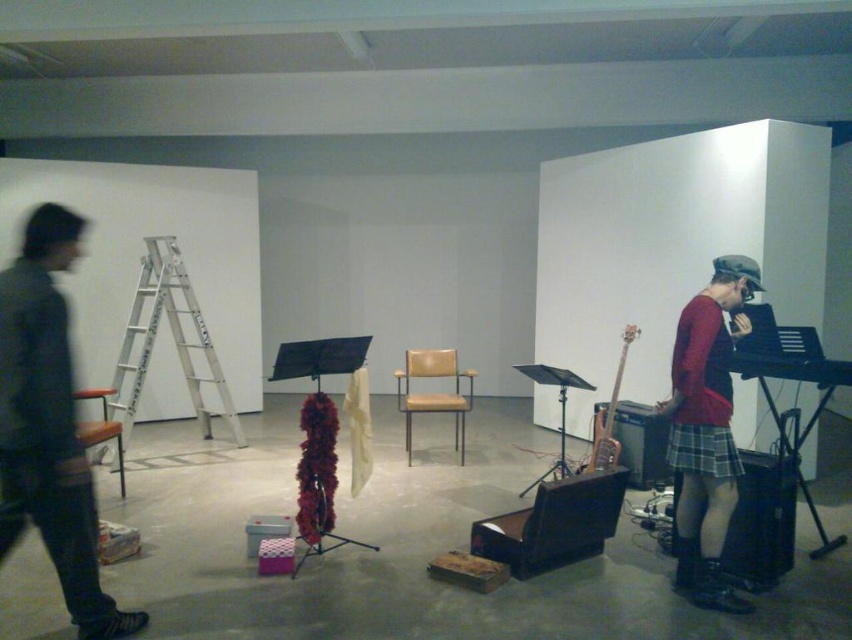
You are an interior designer observing the studio. You need to move the tan leather chair at center to a different location. However, you must ensure that the red matte sweater at right remains visible from the entrance. Can you move the chair without blocking the view of the sweater?

The red matte sweater at right is in front of the tan leather chair at center. Moving the tan leather chair at center away from its current position would allow the sweater to remain visible as it is positioned in front, so yes, moving the chair would not block the view of the sweater.

You are an interior designer planning to place a 2.5 meter tall sculpture in this space. Considering the silver metallic ladder at left and the wooden chair at left, which object might pose a safety concern if the sculpture is placed near them due to its height?

The silver metallic ladder at left is much taller than the wooden chair at left, so placing a 2.5 meter tall sculpture near the silver metallic ladder at left could pose a safety concern because the ladder might interfere with the sculpture or create an unstable setup.